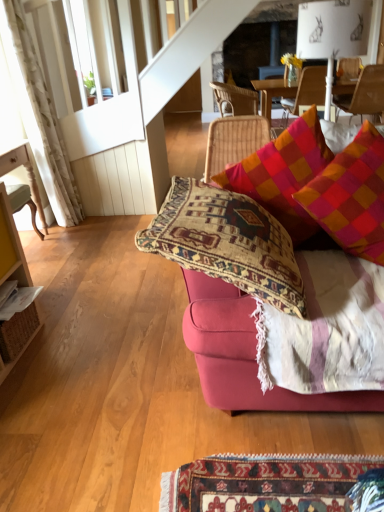
The height and width of the screenshot is (512, 384). Find the location of `free spot below white textured curtain at left (from a real-world perspective)`. free spot below white textured curtain at left (from a real-world perspective) is located at coordinates (76, 220).